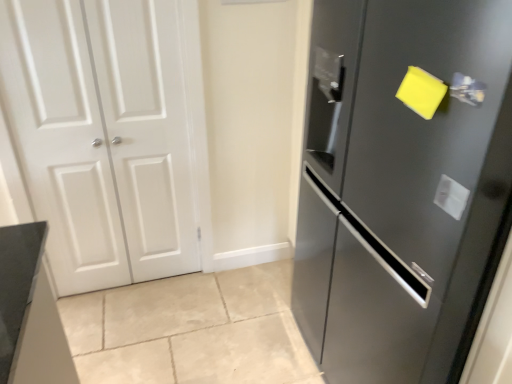
Locate an element on the screen. free space above white matte door at left, which is the second door in right-to-left order (from a real-world perspective) is located at coordinates (77, 0).